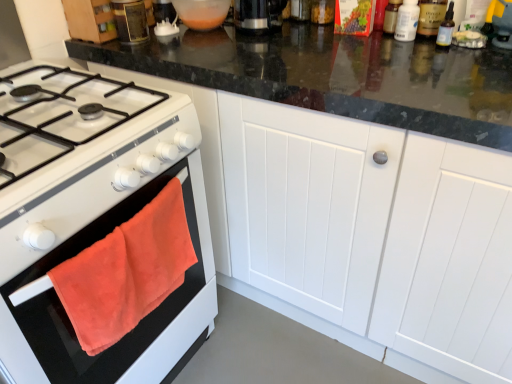
Question: Considering the relative sizes of metallic canister at upper left and transparent plastic bottle at upper right, arranged as the fourth bottle when viewed from the right, in the image provided, is metallic canister at upper left taller than transparent plastic bottle at upper right, arranged as the fourth bottle when viewed from the right,?

Choices:
 (A) yes
 (B) no

Answer: (A)

Question: Is metallic canister at upper left at the right side of transparent plastic bottle at upper right, positioned as the first bottle in left-to-right order?

Choices:
 (A) no
 (B) yes

Answer: (A)

Question: From a real-world perspective, is metallic canister at upper left physically above transparent plastic bottle at upper right, arranged as the fourth bottle when viewed from the right?

Choices:
 (A) no
 (B) yes

Answer: (B)

Question: Does metallic canister at upper left have a lesser width compared to transparent plastic bottle at upper right, arranged as the fourth bottle when viewed from the right?

Choices:
 (A) no
 (B) yes

Answer: (A)

Question: Is metallic canister at upper left wider than transparent plastic bottle at upper right, arranged as the fourth bottle when viewed from the right?

Choices:
 (A) no
 (B) yes

Answer: (B)

Question: Is white plastic bottle at upper right, the 2th bottle positioned from the left, wider or thinner than clear glass bottle at upper right, which is counted as the 1th bottle, starting from the right?

Choices:
 (A) thin
 (B) wide

Answer: (B)

Question: Does point (416, 8) appear closer or farther from the camera than point (442, 46)?

Choices:
 (A) farther
 (B) closer

Answer: (B)

Question: From a real-world perspective, is white plastic bottle at upper right, the 2th bottle positioned from the left, above or below clear glass bottle at upper right, positioned as the fourth bottle in left-to-right order?

Choices:
 (A) above
 (B) below

Answer: (B)

Question: Considering the positions of white plastic bottle at upper right, the third bottle in the right-to-left sequence, and clear glass bottle at upper right, which is counted as the 1th bottle, starting from the right, in the image, is white plastic bottle at upper right, the third bottle in the right-to-left sequence, taller or shorter than clear glass bottle at upper right, which is counted as the 1th bottle, starting from the right,?

Choices:
 (A) tall
 (B) short

Answer: (B)

Question: In terms of size, does translucent plastic bottle at upper right, which ranks as the 2th bottle in right-to-left order, appear bigger or smaller than white plastic bottle at upper right, the third bottle in the right-to-left sequence?

Choices:
 (A) big
 (B) small

Answer: (A)

Question: Considering the positions of point (439, 23) and point (411, 33), is point (439, 23) closer or farther from the camera than point (411, 33)?

Choices:
 (A) farther
 (B) closer

Answer: (B)

Question: Considering the positions of translucent plastic bottle at upper right, which appears as the third bottle when viewed from the left, and white plastic bottle at upper right, the third bottle in the right-to-left sequence, in the image, is translucent plastic bottle at upper right, which appears as the third bottle when viewed from the left, taller or shorter than white plastic bottle at upper right, the third bottle in the right-to-left sequence,?

Choices:
 (A) tall
 (B) short

Answer: (A)

Question: Is translucent plastic bottle at upper right, which appears as the third bottle when viewed from the left, wider or thinner than white plastic bottle at upper right, the third bottle in the right-to-left sequence?

Choices:
 (A) wide
 (B) thin

Answer: (A)

Question: Is metallic canister at upper left wider or thinner than translucent plastic bottle at upper right, which ranks as the 2th bottle in right-to-left order?

Choices:
 (A) thin
 (B) wide

Answer: (B)

Question: Considering the positions of metallic canister at upper left and translucent plastic bottle at upper right, which ranks as the 2th bottle in right-to-left order, in the image, is metallic canister at upper left bigger or smaller than translucent plastic bottle at upper right, which ranks as the 2th bottle in right-to-left order,?

Choices:
 (A) small
 (B) big

Answer: (B)